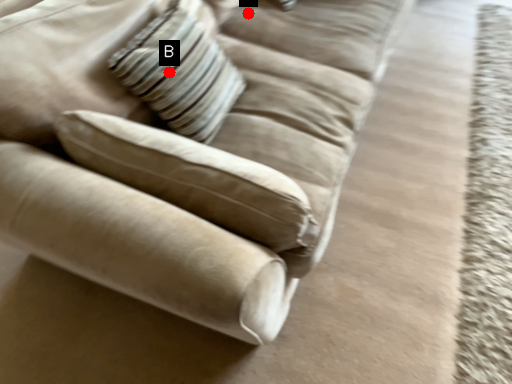
Question: Two points are circled on the image, labeled by A and B beside each circle. Which point appears closest to the camera in this image?

Choices:
 (A) A is closer
 (B) B is closer

Answer: (B)